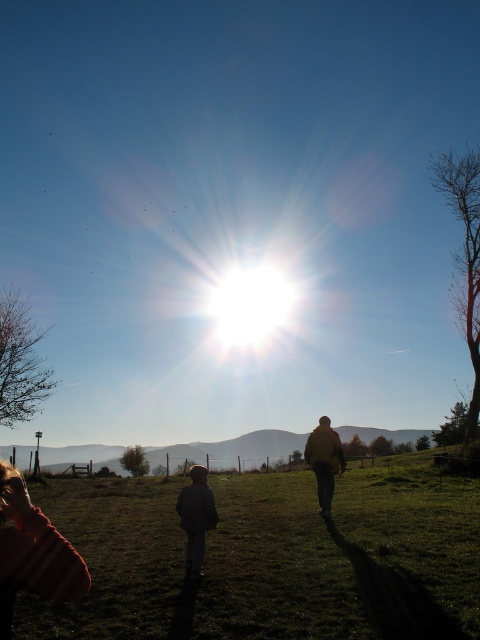
You are a photographer trying to capture a shot of the two jackets in the scene. The dark gray jacket at center and the brown leather jacket at center are both in your viewfinder. Which jacket is closer to the camera?

The dark gray jacket at center is positioned under the brown leather jacket at center, so the dark gray jacket at center is closer to the camera.

You are a photographer trying to capture the two jackets in the scene. Which jacket, the dark gray jacket at center or the brown leather jacket at center, would appear larger in your photo?

The dark gray jacket at center would appear larger in the photo because it is bigger than the brown leather jacket at center.

You are standing in the grassy field and want to walk to the point marked at coordinates [271,557]. According to the image, where exactly is this point located?

The point marked at coordinates [271,557] is located on the green grass at lower center.